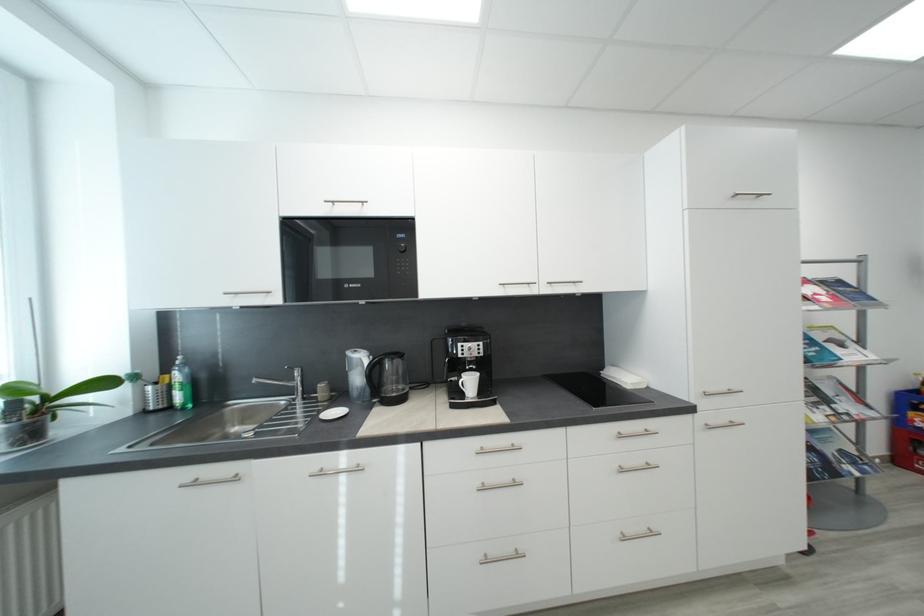
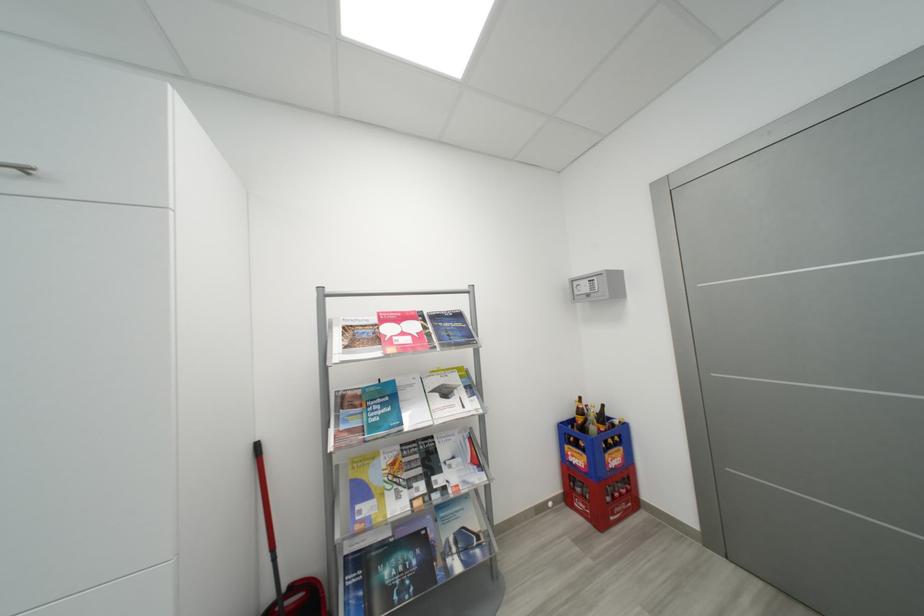
Question: The images are taken continuously from a first-person perspective. In which direction are you moving?

Choices:
 (A) Left
 (B) Right
 (C) Forward
 (D) Backward

Answer: (B)